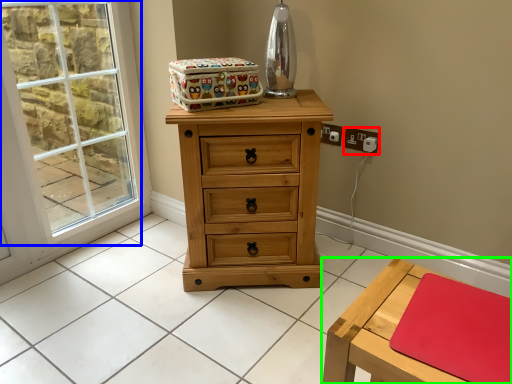
Question: Which object is positioned closest to electric outlet (highlighted by a red box)? Select from window (highlighted by a blue box) and table (highlighted by a green box).

Choices:
 (A) window
 (B) table

Answer: (B)